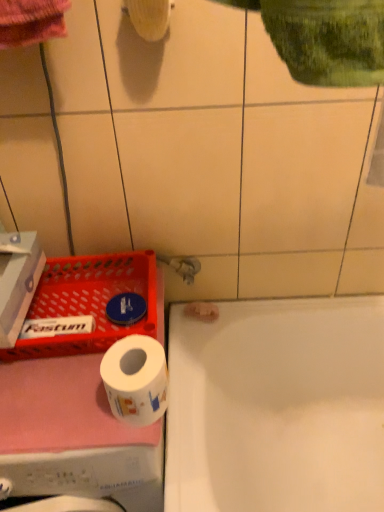
Question: Based on their sizes in the image, would you say white matte toilet paper at lower left is bigger or smaller than white glossy washing machine at lower left?

Choices:
 (A) big
 (B) small

Answer: (B)

Question: From the image's perspective, is white matte toilet paper at lower left located above or below white glossy washing machine at lower left?

Choices:
 (A) above
 (B) below

Answer: (A)

Question: Estimate the real-world distances between objects in this image. Which object is closer to the white matte toilet paper at lower left?

Choices:
 (A) white cardboard box at left
 (B) white glossy washing machine at lower left
 (C) white glossy bathtub at lower right
 (D) red plastic tray at lower left

Answer: (B)

Question: Considering the real-world distances, which object is farthest from the white glossy washing machine at lower left?

Choices:
 (A) white matte toilet paper at lower left
 (B) red plastic tray at lower left
 (C) white cardboard box at left
 (D) white glossy bathtub at lower right

Answer: (D)